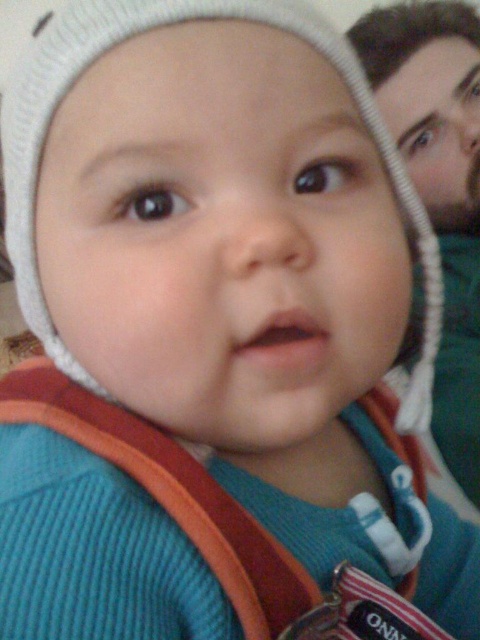
Question: Which point is farther from the camera taking this photo?

Choices:
 (A) (450, 365)
 (B) (429, 49)

Answer: (B)

Question: Is the position of bearded man at right less distant than that of bearded man at upper right?

Choices:
 (A) no
 (B) yes

Answer: (B)

Question: Which of the following is the closest to the observer?

Choices:
 (A) bearded man at right
 (B) bearded man at upper right

Answer: (A)

Question: Can you confirm if bearded man at right is wider than bearded man at upper right?

Choices:
 (A) yes
 (B) no

Answer: (B)

Question: Which point appears closest to the camera in this image?

Choices:
 (A) (476, 204)
 (B) (456, 381)

Answer: (B)

Question: Can you confirm if bearded man at right is smaller than bearded man at upper right?

Choices:
 (A) no
 (B) yes

Answer: (A)